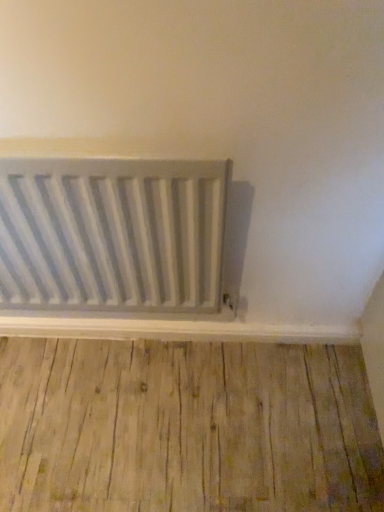
Where is `free region under white matte radiator at center (from a real-world perspective)`? This screenshot has width=384, height=512. free region under white matte radiator at center (from a real-world perspective) is located at coordinates (127, 351).